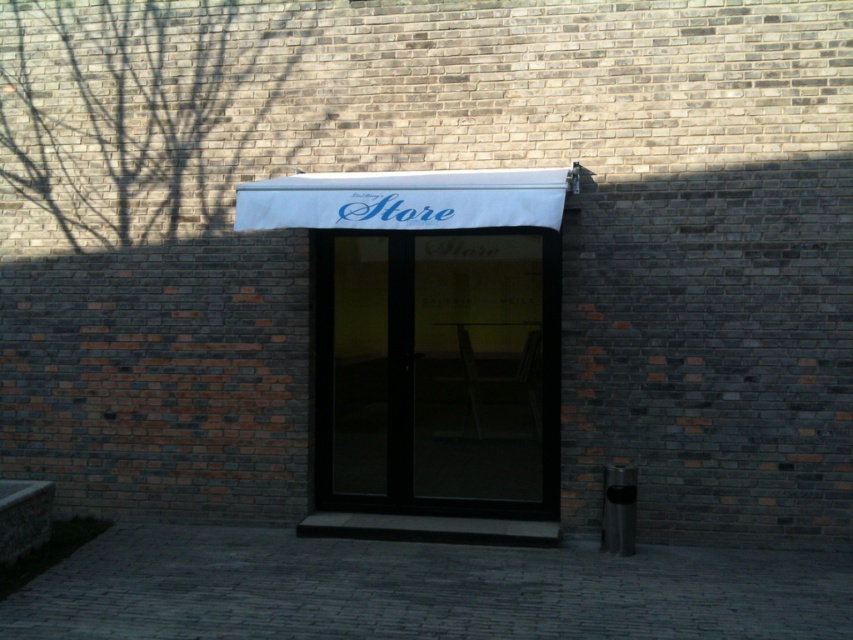
You are a delivery person trying to read the store name on the white fabric store sign at center. Can you read it clearly through the transparent glass door at center?

The white fabric store sign at center is behind the transparent glass door at center, so yes, you can read it clearly through the transparent glass door at center.

In the scene shown: You are standing in front of the building and looking at the brick wall. There are two points marked on the wall at coordinates point (436, 269) and point (529, 211). Which point is closer to you?

Point (436, 269) is further to the camera than point (529, 211), so the point closer to you is point (529, 211).

You are a delivery person trying to deliver a package to the Store. You see the transparent glass door at center and the white fabric store sign at center. Which object is narrower?

The transparent glass door at center is thinner than the white fabric store sign at center, so the transparent glass door at center is narrower.